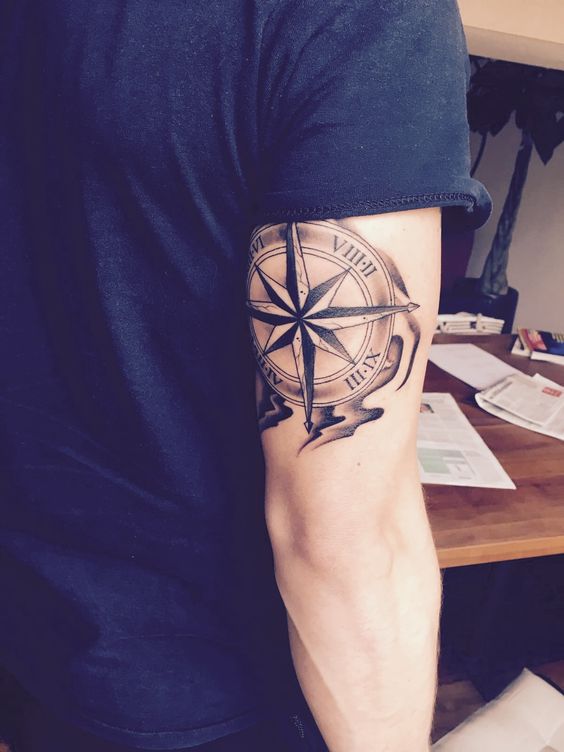
Locate an element on the screen. The width and height of the screenshot is (564, 752). books is located at coordinates (534, 337).